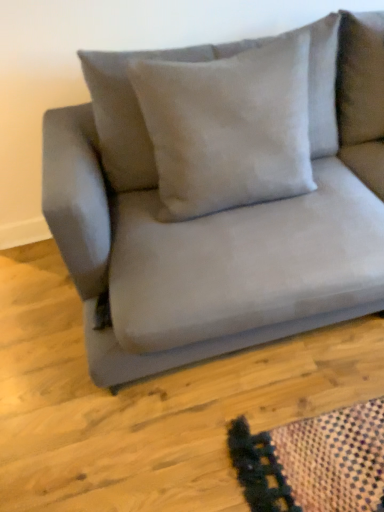
Describe the element at coordinates (216, 205) in the screenshot. I see `suede gray couch at center` at that location.

Identify the location of suede gray couch at center. The height and width of the screenshot is (512, 384). (216, 205).

This screenshot has height=512, width=384. Identify the location of suede gray couch at center. (216, 205).